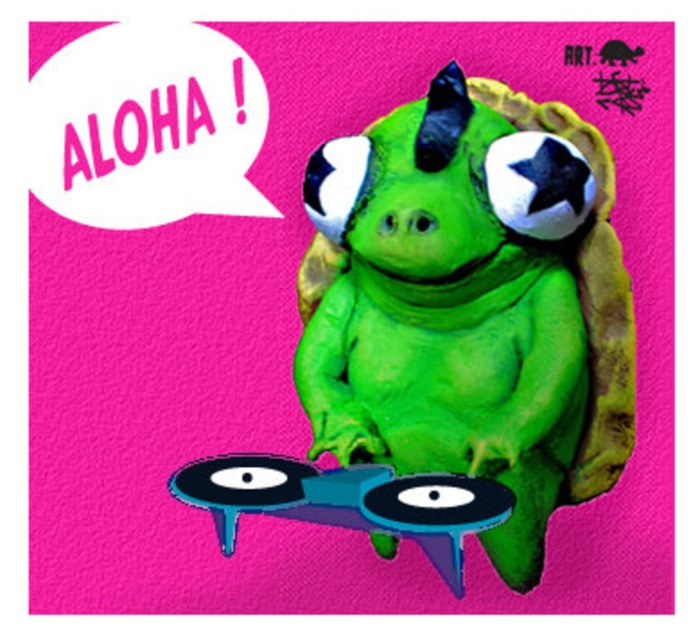
Is green rubber turtle at center smaller than blue rubber record at center?

No, green rubber turtle at center is not smaller than blue rubber record at center.

Which is above, green rubber turtle at center or blue rubber record at center?

green rubber turtle at center is higher up.

The height and width of the screenshot is (640, 700). What do you see at coordinates (470, 307) in the screenshot?
I see `green rubber turtle at center` at bounding box center [470, 307].

Where is `green rubber turtle at center`? The height and width of the screenshot is (640, 700). green rubber turtle at center is located at coordinates (470, 307).